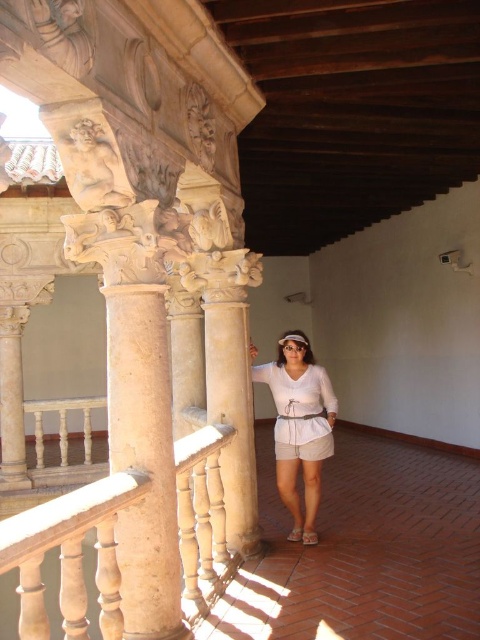
You are a photographer trying to capture a detailed shot of the beige stone column at center and the white fabric sandal at lower center. Which object should you focus on first if you want to ensure both are in focus without adjusting the camera settings?

You should focus on the beige stone column at center first because it is closer to the viewer than the white fabric sandal at lower center. By focusing on the closer object, the farther object will also be in focus if they are within the depth of field range.

You are a photographer trying to capture the woman in the scene. The woman is wearing both a white cotton dress at center and white cotton shorts at center. Which clothing item is visible below the other?

The white cotton shorts at center is positioned under white cotton dress at center, so the shorts are not visible below the dress.